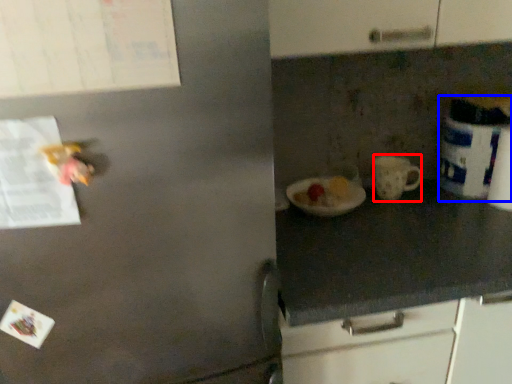
Question: Which of the following is the farthest to the observer, mug (highlighted by a red box) or appliance (highlighted by a blue box)?

Choices:
 (A) mug
 (B) appliance

Answer: (A)